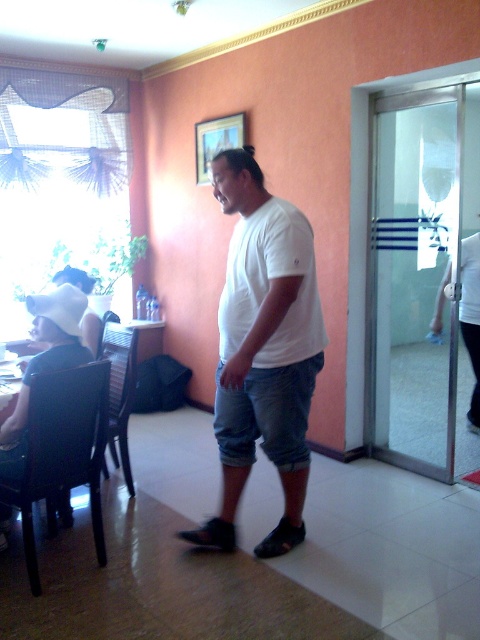
Between transparent glass door at right and white matte t-shirt at center, which one is positioned lower?

white matte t-shirt at center is lower down.

This screenshot has width=480, height=640. Describe the element at coordinates (415, 276) in the screenshot. I see `transparent glass door at right` at that location.

Who is more forward, [450,218] or [253,236]?

Point [253,236] is more forward.

Find the location of `transparent glass door at right`. transparent glass door at right is located at coordinates (415, 276).